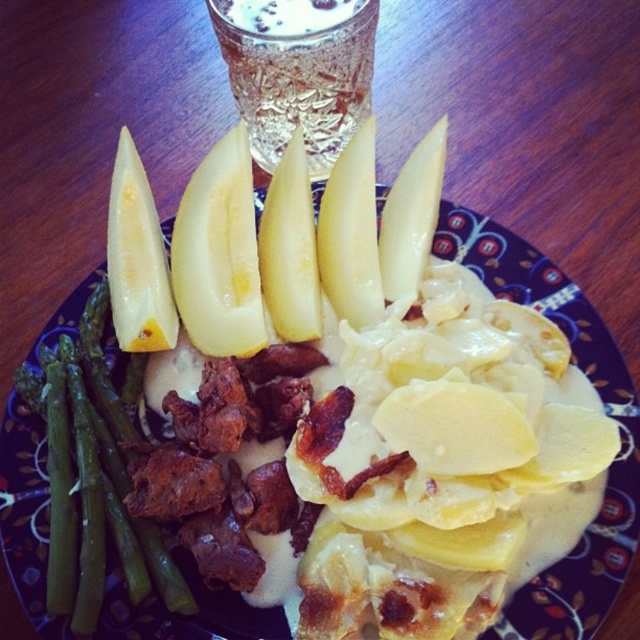
Question: Observing the image, what is the correct spatial positioning of yellow matte potato at center in reference to clear glass beverage at upper center?

Choices:
 (A) below
 (B) above

Answer: (A)

Question: Is green smooth asparagus at left in front of yellow smooth apple at upper left?

Choices:
 (A) no
 (B) yes

Answer: (B)

Question: Is yellow matte potato at center to the right of clear glass beverage at upper center from the viewer's perspective?

Choices:
 (A) yes
 (B) no

Answer: (A)

Question: Estimate the real-world distances between objects in this image. Which object is closer to the green smooth asparagus at left?

Choices:
 (A) yellow matte potato at center
 (B) yellow smooth apple at upper left

Answer: (A)

Question: Considering the real-world distances, which object is farthest from the yellow matte potato at center?

Choices:
 (A) clear glass beverage at upper center
 (B) yellow smooth apple at upper left
 (C) green smooth asparagus at left

Answer: (A)

Question: Which point is closer to the camera?

Choices:
 (A) green smooth asparagus at left
 (B) clear glass beverage at upper center
 (C) yellow matte potato at center

Answer: (C)